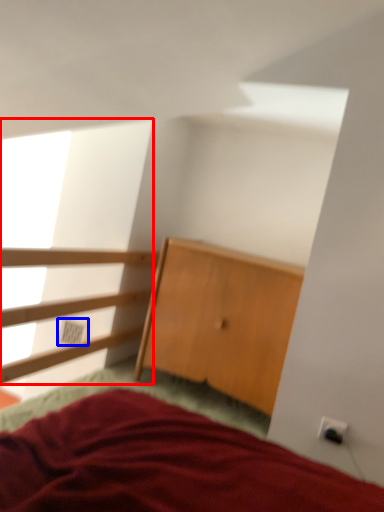
Question: Which point is further to the camera, window screen (highlighted by a red box) or electric outlet (highlighted by a blue box)?

Choices:
 (A) window screen
 (B) electric outlet

Answer: (B)